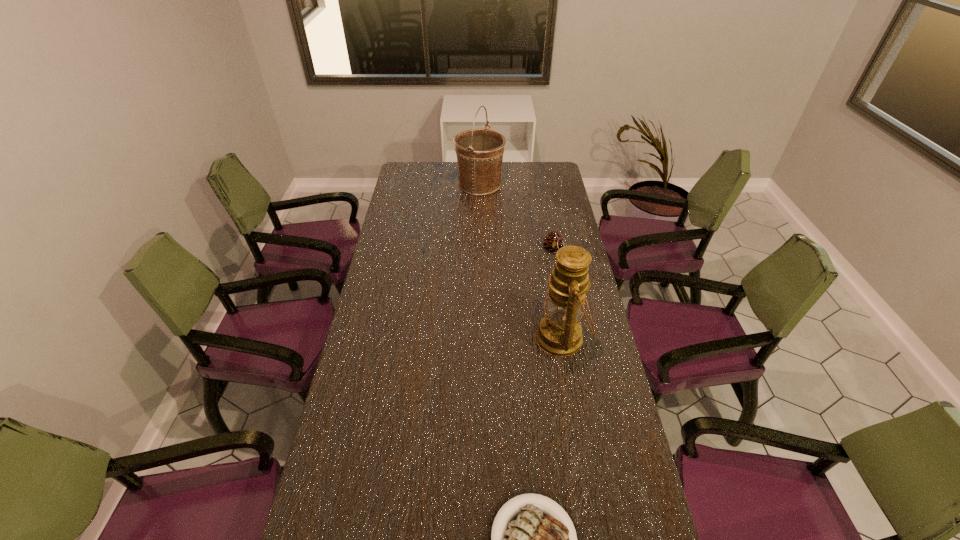
Identify the location of vacant space at the left edge of the desktop. (418, 192).

In the image, there is a desktop. At what (x,y) coordinates should I click in order to perform the action: click on vacant space at the right edge. Please return your answer as a coordinate pair (x, y). This screenshot has width=960, height=540. Looking at the image, I should click on (645, 517).

Locate an element on the screen. free space at the far left corner of the desktop is located at coordinates (408, 172).

Where is `free spot between the oil lamp and the farthest object`? The height and width of the screenshot is (540, 960). free spot between the oil lamp and the farthest object is located at coordinates (520, 261).

Where is `object that is the third closest one to the nearest object`? The height and width of the screenshot is (540, 960). object that is the third closest one to the nearest object is located at coordinates (479, 152).

Where is `object that is the nearest to the farthest object`? This screenshot has height=540, width=960. object that is the nearest to the farthest object is located at coordinates (553, 242).